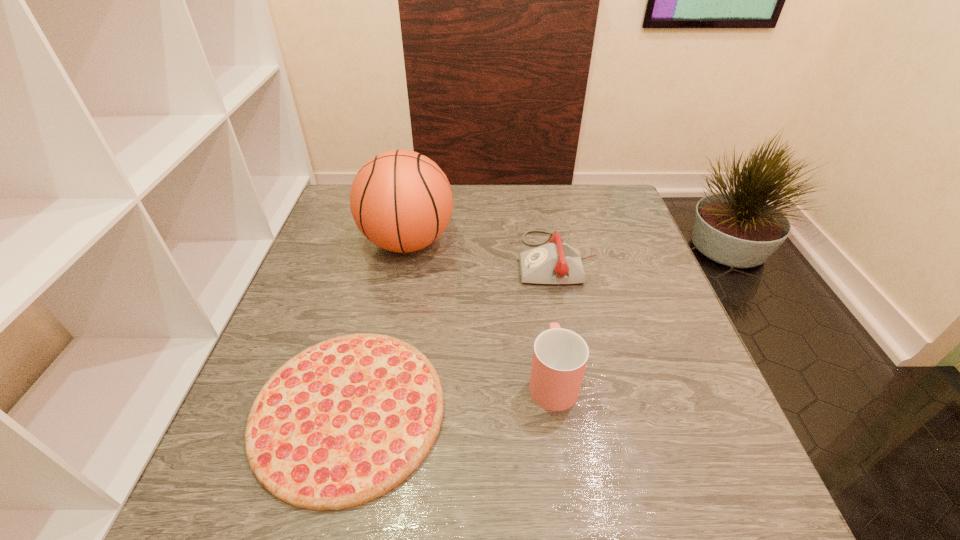
You are a GUI agent. You are given a task and a screenshot of the screen. Output one action in this format:
    pyautogui.click(x=<x>, y=<y>)
    Task: Click on the blank space located on the dial of the third tallest object
    
    Given the screenshot: What is the action you would take?
    pyautogui.click(x=454, y=259)

Locate an element on the screen. The image size is (960, 540). object present at the far edge is located at coordinates (401, 201).

The height and width of the screenshot is (540, 960). I want to click on object that is positioned at the near edge, so click(x=345, y=421).

The image size is (960, 540). Identify the location of basketball located at the left edge. (401, 201).

Locate an element on the screen. This screenshot has height=540, width=960. pizza that is at the left edge is located at coordinates click(x=345, y=421).

I want to click on object present at the right edge, so click(556, 263).

Where is `object located at the far left corner`? object located at the far left corner is located at coordinates (401, 201).

This screenshot has height=540, width=960. What are the coordinates of `object located in the near left corner section of the desktop` in the screenshot? It's located at (345, 421).

In the image, there is a desktop. What are the coordinates of `vacant region at the far edge` in the screenshot? It's located at (478, 197).

I want to click on free space at the near edge, so click(448, 484).